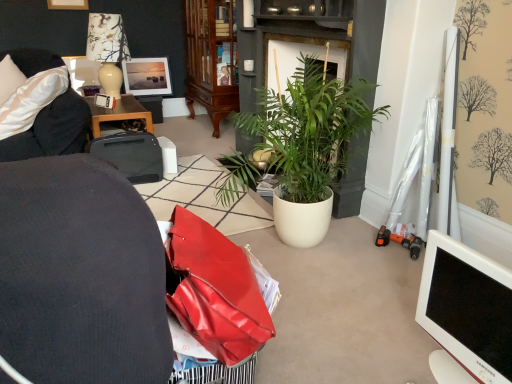
Question: Considering the relative sizes of wooden picture frame at upper left, which ranks as the second picture frame in bottom-to-top order, and green leafy plant at center in the image provided, is wooden picture frame at upper left, which ranks as the second picture frame in bottom-to-top order, thinner than green leafy plant at center?

Choices:
 (A) yes
 (B) no

Answer: (A)

Question: From the image's perspective, is wooden picture frame at upper left, the 1th picture frame in the front-to-back sequence, beneath green leafy plant at center?

Choices:
 (A) no
 (B) yes

Answer: (A)

Question: From a real-world perspective, is wooden picture frame at upper left, which is the 2th picture frame from back to front, below green leafy plant at center?

Choices:
 (A) no
 (B) yes

Answer: (A)

Question: Considering the relative positions of wooden picture frame at upper left, which ranks as the second picture frame in bottom-to-top order, and green leafy plant at center in the image provided, is wooden picture frame at upper left, which ranks as the second picture frame in bottom-to-top order, to the left of green leafy plant at center from the viewer's perspective?

Choices:
 (A) no
 (B) yes

Answer: (B)

Question: Is the depth of wooden picture frame at upper left, which ranks as the second picture frame in bottom-to-top order, greater than that of green leafy plant at center?

Choices:
 (A) no
 (B) yes

Answer: (B)

Question: Can you confirm if wooden picture frame at upper left, which ranks as the second picture frame in bottom-to-top order, is bigger than green leafy plant at center?

Choices:
 (A) yes
 (B) no

Answer: (B)

Question: From a real-world perspective, is mahogany glass-front cabinet at center beneath black plastic printer at center?

Choices:
 (A) yes
 (B) no

Answer: (B)

Question: Is mahogany glass-front cabinet at center oriented towards black plastic printer at center?

Choices:
 (A) yes
 (B) no

Answer: (B)

Question: Is mahogany glass-front cabinet at center next to black plastic printer at center and touching it?

Choices:
 (A) yes
 (B) no

Answer: (B)

Question: Does mahogany glass-front cabinet at center have a greater height compared to black plastic printer at center?

Choices:
 (A) yes
 (B) no

Answer: (A)

Question: From the image's perspective, is mahogany glass-front cabinet at center located beneath black plastic printer at center?

Choices:
 (A) no
 (B) yes

Answer: (A)

Question: Does mahogany glass-front cabinet at center lie behind black plastic printer at center?

Choices:
 (A) no
 (B) yes

Answer: (B)

Question: Are black plastic printer at center and green leafy plant at center far apart?

Choices:
 (A) no
 (B) yes

Answer: (B)